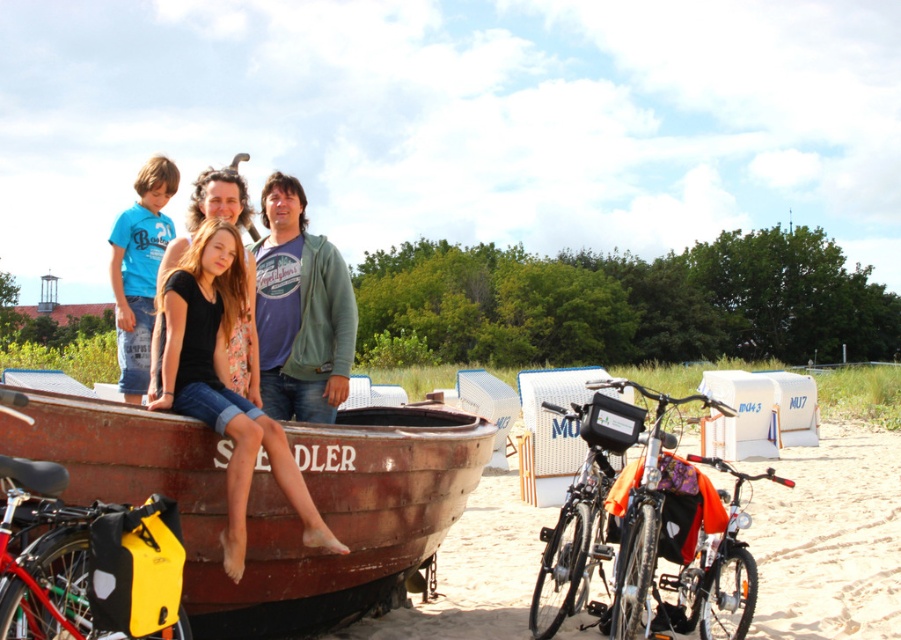
You are a photographer setting up a tripod to capture the scene. The yellow matte bag at lower left and the shiny metallic bicycle at center are in your shot. Which object is shorter?

The yellow matte bag at lower left is not as tall as the shiny metallic bicycle at center, so the yellow matte bag at lower left is shorter.